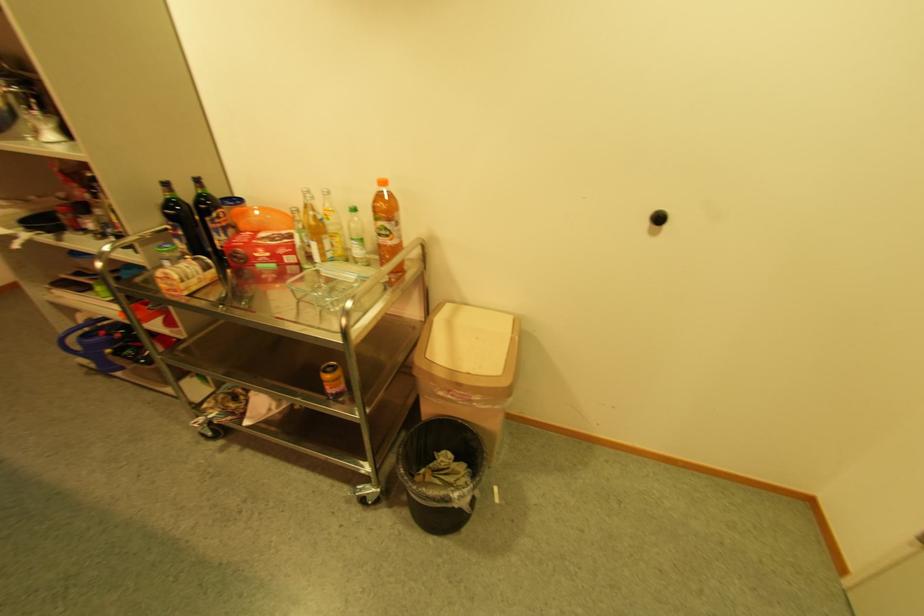
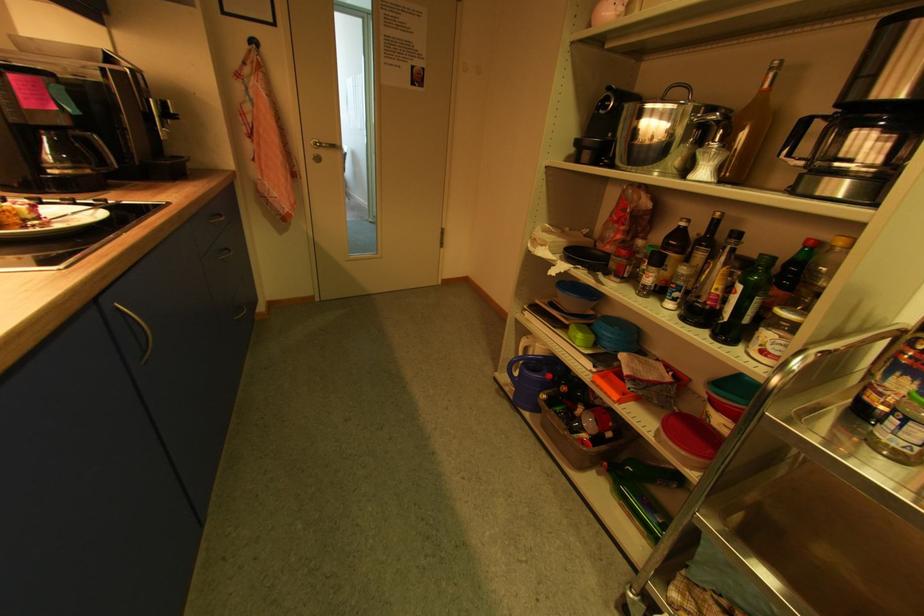
In the second image, find the point that corresponds to (x=57, y=137) in the first image.

(709, 175)